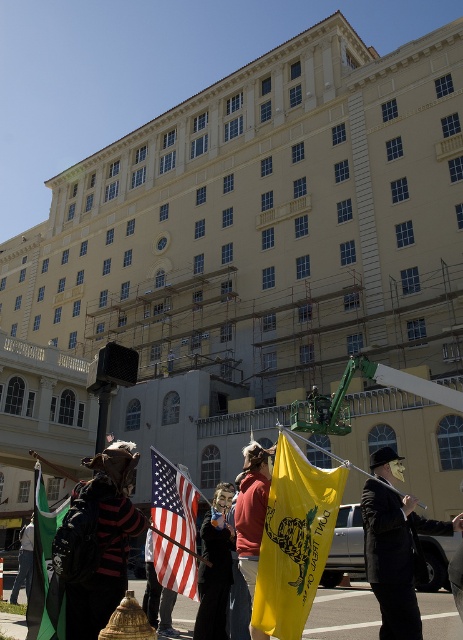
Question: Observing the image, what is the correct spatial positioning of yellow fabric flag at center in reference to reddish-brown leather jacket at center?

Choices:
 (A) left
 (B) right

Answer: (B)

Question: Which point is closer to the camera?

Choices:
 (A) (285, 544)
 (B) (393, 472)
 (C) (256, 634)

Answer: (A)

Question: Does black leather coat at center come behind reddish-brown leather jacket at center?

Choices:
 (A) no
 (B) yes

Answer: (A)

Question: Based on their relative distances, which object is nearer to the american flag at center?

Choices:
 (A) yellow fabric flag at center
 (B) matte black mask at center
 (C) black leather coat at center
 (D) green fabric flag at lower left

Answer: (B)

Question: Is yellow fabric flag at center below matte black mask at center?

Choices:
 (A) no
 (B) yes

Answer: (A)

Question: Which point is closer to the camera?

Choices:
 (A) (417, 524)
 (B) (281, 588)
 (C) (175, 504)
 (D) (254, 442)

Answer: (B)